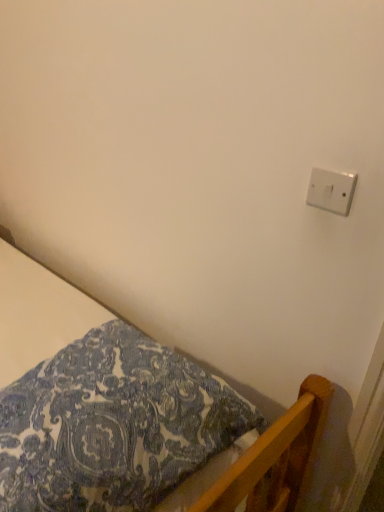
I want to click on patterned fabric bed at lower left, so click(x=38, y=313).

This screenshot has width=384, height=512. Describe the element at coordinates (38, 313) in the screenshot. I see `patterned fabric bed at lower left` at that location.

This screenshot has height=512, width=384. Describe the element at coordinates (331, 190) in the screenshot. I see `white plastic light switch at upper right` at that location.

What is the approximate width of white plastic light switch at upper right?

white plastic light switch at upper right is 0.79 inches in width.

Locate an element on the screen. white plastic light switch at upper right is located at coordinates (331, 190).

The width and height of the screenshot is (384, 512). I want to click on patterned fabric bed at lower left, so click(x=38, y=313).

Can you confirm if white plastic light switch at upper right is positioned to the right of patterned fabric bed at lower left?

Yes.

Which object is closer to the camera taking this photo, white plastic light switch at upper right or patterned fabric bed at lower left?

patterned fabric bed at lower left is more forward.

Is point (353, 193) closer or farther from the camera than point (3, 340)?

Point (353, 193) appears to be closer to the viewer than point (3, 340).

From the image's perspective, is white plastic light switch at upper right located above patterned fabric bed at lower left?

Yes, from the image's perspective, white plastic light switch at upper right is on top of patterned fabric bed at lower left.

In the scene shown: From a real-world perspective, between white plastic light switch at upper right and patterned fabric bed at lower left, who is vertically higher?

A: white plastic light switch at upper right is physically above.

Which of these two, white plastic light switch at upper right or patterned fabric bed at lower left, is thinner?

white plastic light switch at upper right is thinner.

Who is shorter, white plastic light switch at upper right or patterned fabric bed at lower left?

white plastic light switch at upper right is shorter.

Based on the photo, in terms of size, does white plastic light switch at upper right appear bigger or smaller than patterned fabric bed at lower left?

white plastic light switch at upper right is smaller than patterned fabric bed at lower left.

Is white plastic light switch at upper right positioned beyond the bounds of patterned fabric bed at lower left?

Indeed, white plastic light switch at upper right is completely outside patterned fabric bed at lower left.

Are white plastic light switch at upper right and patterned fabric bed at lower left beside each other?

white plastic light switch at upper right is not next to patterned fabric bed at lower left, and they're not touching.

Is white plastic light switch at upper right looking in the opposite direction of patterned fabric bed at lower left?

white plastic light switch at upper right is not turned away from patterned fabric bed at lower left.

Image resolution: width=384 pixels, height=512 pixels. I want to click on light switch above the patterned fabric bed at lower left (from a real-world perspective), so click(x=331, y=190).

Does patterned fabric bed at lower left appear on the right side of white plastic light switch at upper right?

No.

Which object is more forward, patterned fabric bed at lower left or white plastic light switch at upper right?

Positioned in front is patterned fabric bed at lower left.

Which is behind, point (103, 320) or point (314, 176)?

The point (103, 320) is behind.

From the image's perspective, which one is positioned higher, patterned fabric bed at lower left or white plastic light switch at upper right?

From the image's view, white plastic light switch at upper right is above.

From a real-world perspective, who is located lower, patterned fabric bed at lower left or white plastic light switch at upper right?

In real-world perspective, patterned fabric bed at lower left is lower.

Can you confirm if patterned fabric bed at lower left is thinner than white plastic light switch at upper right?

Incorrect, the width of patterned fabric bed at lower left is not less than that of white plastic light switch at upper right.

Between patterned fabric bed at lower left and white plastic light switch at upper right, which one has less height?

Standing shorter between the two is white plastic light switch at upper right.

Which of these two, patterned fabric bed at lower left or white plastic light switch at upper right, is smaller?

Smaller between the two is white plastic light switch at upper right.

Is white plastic light switch at upper right completely or partially inside patterned fabric bed at lower left?

Actually, white plastic light switch at upper right is outside patterned fabric bed at lower left.

Is patterned fabric bed at lower left far from white plastic light switch at upper right?

No.

Looking at this image, is patterned fabric bed at lower left aimed at white plastic light switch at upper right?

No.

How far apart are patterned fabric bed at lower left and white plastic light switch at upper right?

patterned fabric bed at lower left is 34.01 inches from white plastic light switch at upper right.

Find the location of a particular element. Image resolution: width=384 pixels, height=512 pixels. bed below the white plastic light switch at upper right (from a real-world perspective) is located at coordinates (38, 313).

At what (x,y) coordinates should I click in order to perform the action: click on bed on the left of white plastic light switch at upper right. Please return your answer as a coordinate pair (x, y). The width and height of the screenshot is (384, 512). Looking at the image, I should click on (38, 313).

Image resolution: width=384 pixels, height=512 pixels. I want to click on light switch behind the patterned fabric bed at lower left, so click(331, 190).